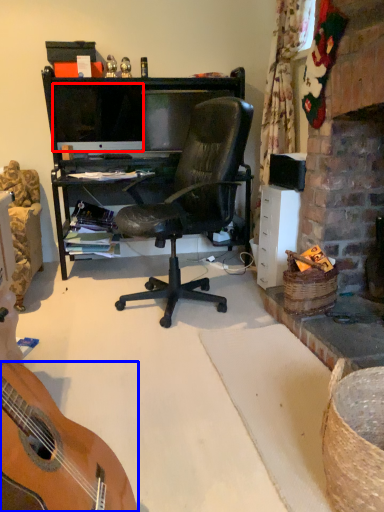
Question: Which point is further to the camera, television (highlighted by a red box) or guitar (highlighted by a blue box)?

Choices:
 (A) television
 (B) guitar

Answer: (A)